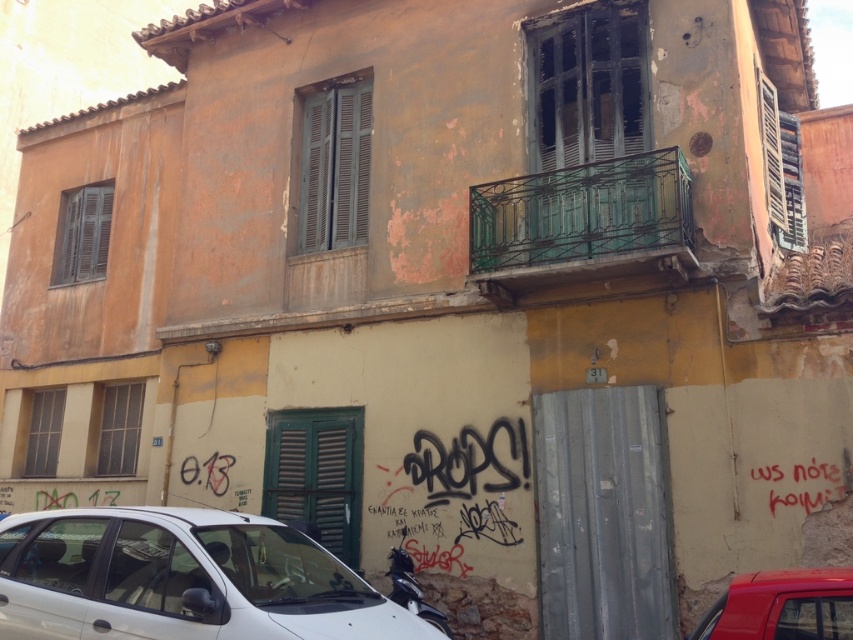
Question: Which of the following is the farthest from the observer?

Choices:
 (A) (637, 616)
 (B) (641, 108)
 (C) (59, 276)
 (D) (312, 236)

Answer: (C)

Question: Is the position of metallic corrugated door at lower right more distant than that of shiny red car at lower right?

Choices:
 (A) no
 (B) yes

Answer: (B)

Question: From the image, what is the correct spatial relationship of green painted wood at upper center in relation to shiny red car at lower right?

Choices:
 (A) right
 (B) left

Answer: (A)

Question: Which of these objects is positioned farthest from the white matte car at lower left?

Choices:
 (A) wooden shutters at left
 (B) matte gray shutters at center

Answer: (A)

Question: Observing the image, what is the correct spatial positioning of white matte car at lower left in reference to matte gray shutter at lower left?

Choices:
 (A) below
 (B) above

Answer: (A)

Question: Based on their relative distances, which object is farther from the green painted wood at upper center?

Choices:
 (A) wooden shutters at left
 (B) matte gray shutter at lower left
 (C) metallic corrugated door at lower right
 (D) white matte car at lower left

Answer: (B)